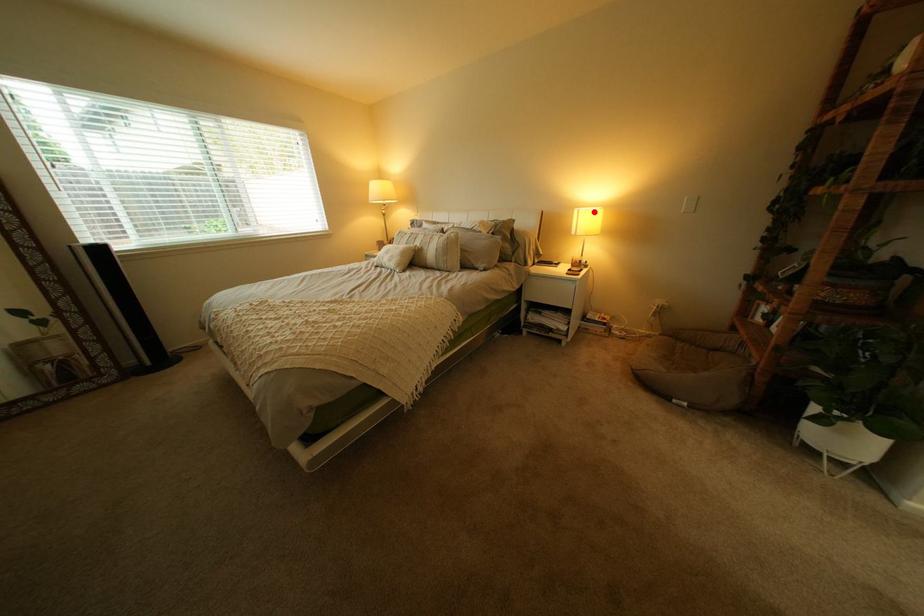
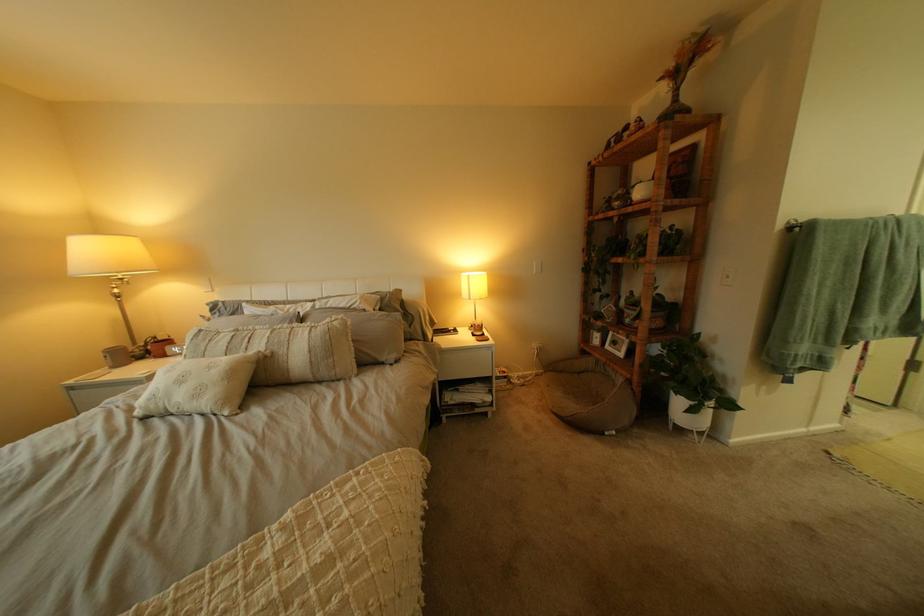
Question: I am providing you with two images of the same scene from different viewpoints. Image1 has a red point marked. In image2, the corresponding 3D location appears at what relative position? Reply with the corresponding letter.

Choices:
 (A) Closer
 (B) Farther

Answer: (B)